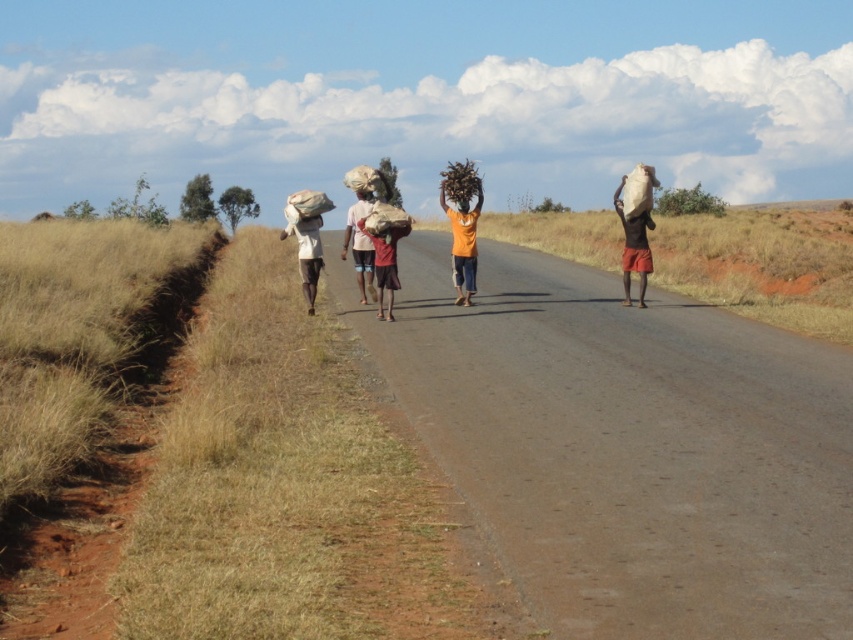
Question: Does brown fabric sack at center lie behind orange matte shirt at center?

Choices:
 (A) no
 (B) yes

Answer: (A)

Question: Which of the following is the closest to the observer?

Choices:
 (A) orange matte shirt at center
 (B) white fabric bag at center
 (C) brown fabric sack at center
 (D) smooth brown head at center

Answer: (C)

Question: Which of these objects is positioned closest to the brown fabric sack at center?

Choices:
 (A) matte brown bag at right
 (B) orange matte shirt at center

Answer: (B)

Question: Is white fabric bag at center above orange matte shirt at center?

Choices:
 (A) yes
 (B) no

Answer: (B)

Question: Estimate the real-world distances between objects in this image. Which object is farther from the matte brown bag at right?

Choices:
 (A) smooth brown head at center
 (B) brown fabric sack at center
 (C) orange matte shirt at center

Answer: (A)

Question: Can you confirm if matte brown bag at right is positioned below smooth brown head at center?

Choices:
 (A) no
 (B) yes

Answer: (A)